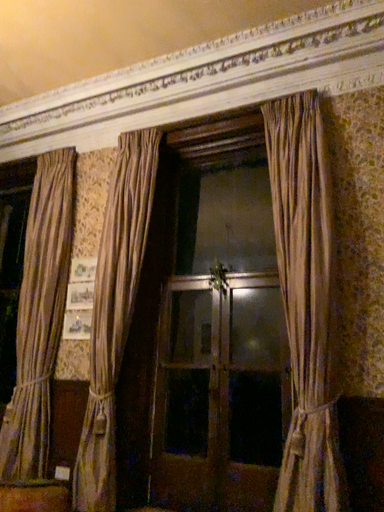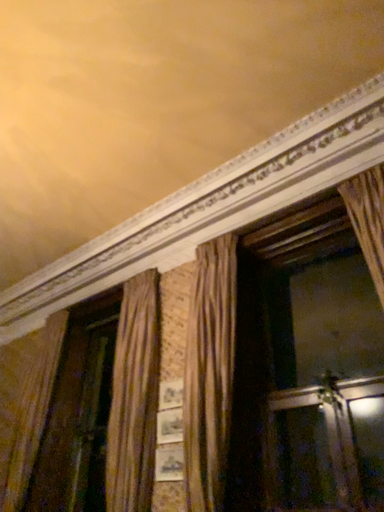
Question: How did the camera likely rotate when shooting the video?

Choices:
 (A) rotated downward
 (B) rotated upward

Answer: (B)